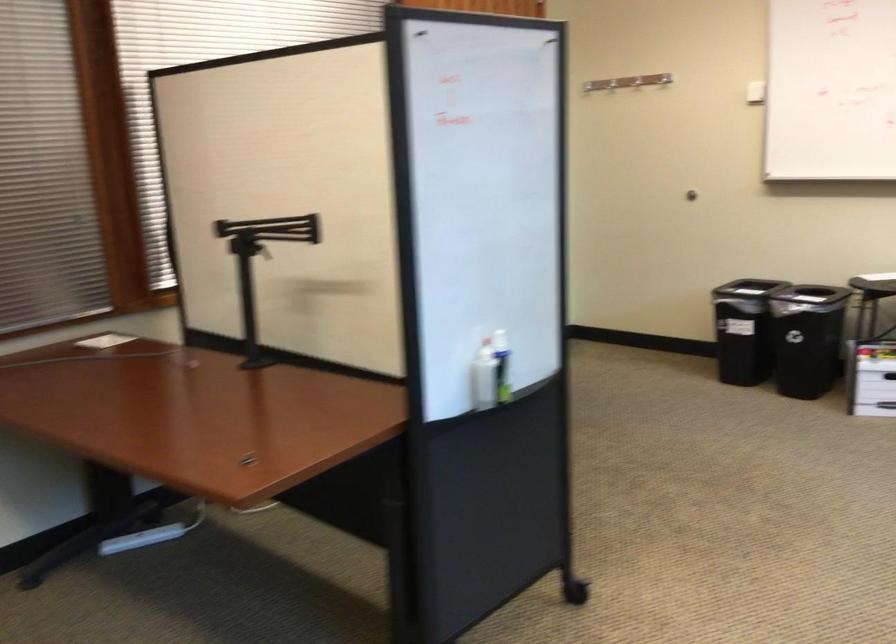
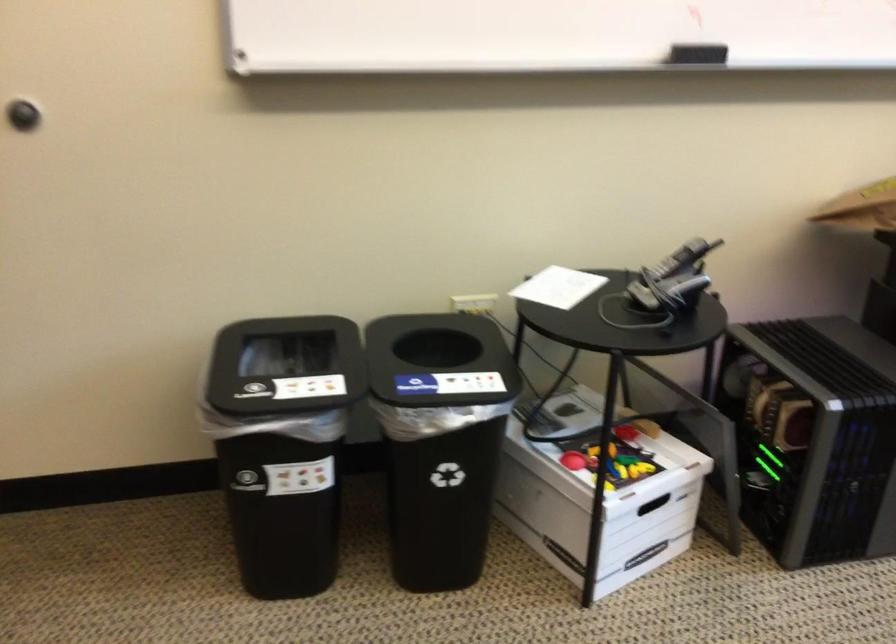
Question: I am providing you with two images of the same scene from different viewpoints. Please identify which objects are invisible in image2.

Choices:
 (A) white paper sheet
 (B) black whiteboard eraser
 (C) storage box handle
 (D) none of these

Answer: (D)